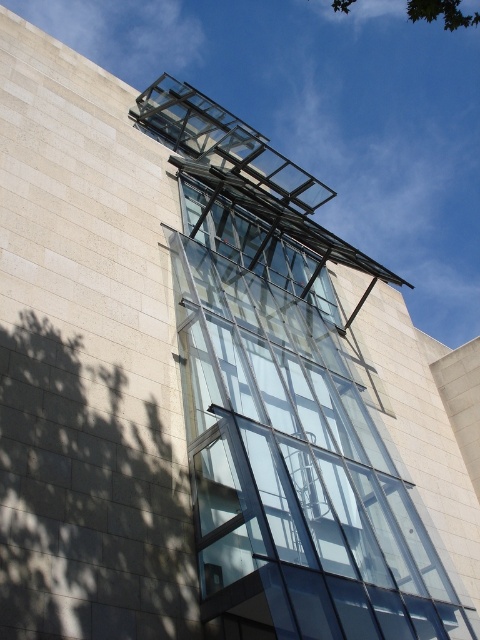
Question: Can you confirm if transparent glass elevator at center is wider than green leafy tree at upper center?

Choices:
 (A) no
 (B) yes

Answer: (A)

Question: Considering the relative positions of transparent glass elevator at center and green leafy tree at upper center in the image provided, where is transparent glass elevator at center located with respect to green leafy tree at upper center?

Choices:
 (A) right
 (B) left

Answer: (B)

Question: Which point is farther from the camera taking this photo?

Choices:
 (A) (447, 20)
 (B) (429, 618)

Answer: (A)

Question: Can you confirm if transparent glass elevator at center is wider than green leafy tree at upper center?

Choices:
 (A) yes
 (B) no

Answer: (B)

Question: Which of the following is the farthest from the observer?

Choices:
 (A) transparent glass elevator at center
 (B) green leafy tree at upper center

Answer: (B)